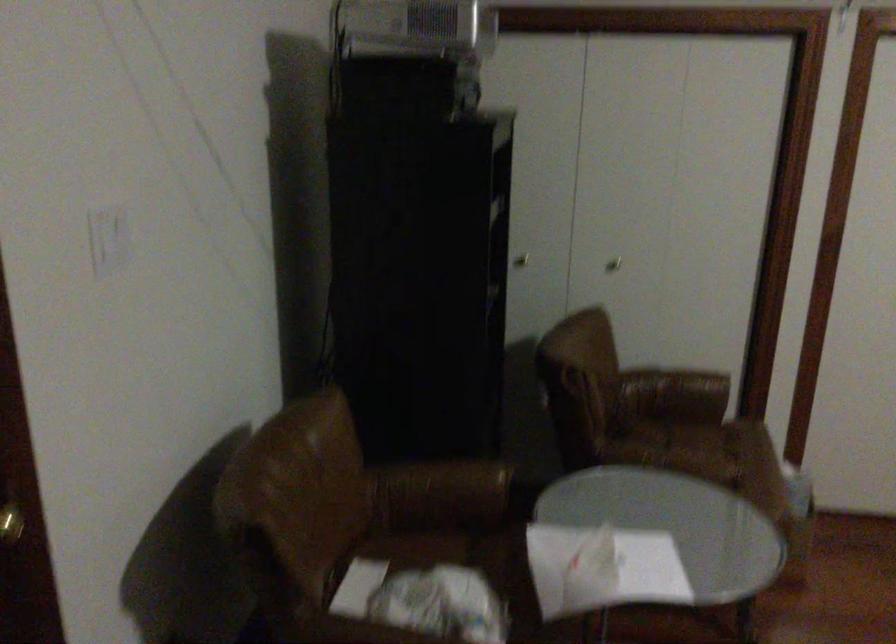
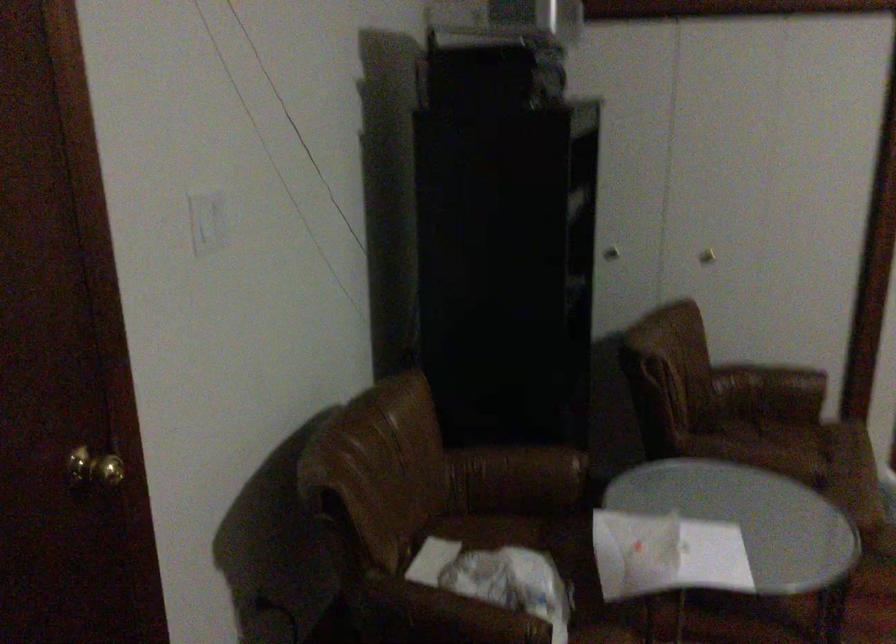
What movement of the cameraman would produce the second image?

The cameraman moved toward right, backward.